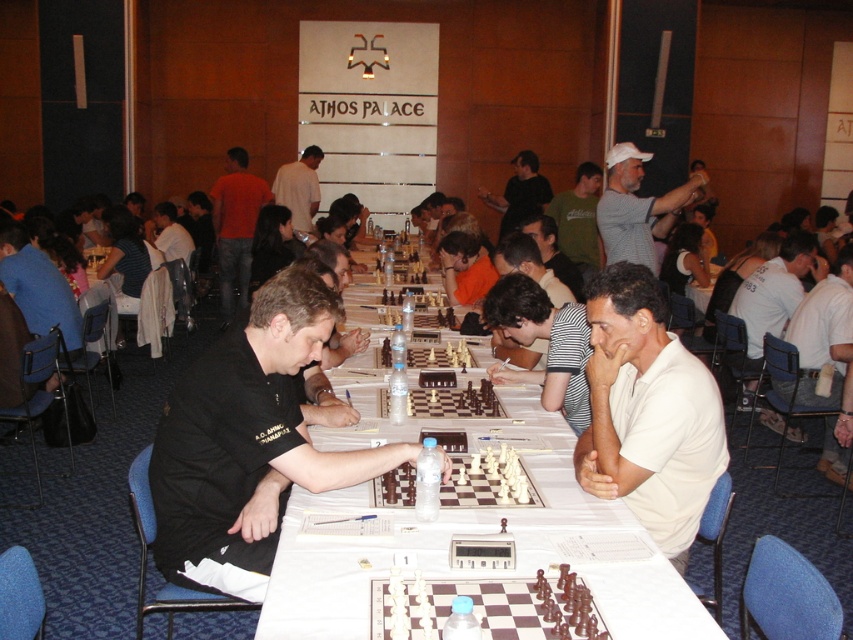
Is point (167, 490) positioned after point (598, 339)?

No, (167, 490) is closer to viewer.

Does black shirt at center appear over white matte shirt at center?

No, black shirt at center is not above white matte shirt at center.

Between point (241, 364) and point (643, 493), which one is positioned behind?

The point (643, 493) is behind.

Locate an element on the screen. Image resolution: width=853 pixels, height=640 pixels. black shirt at center is located at coordinates (247, 444).

Can you confirm if white cloth table at center is thinner than matte black shirt at center?

In fact, white cloth table at center might be wider than matte black shirt at center.

Does white cloth table at center come in front of matte black shirt at center?

Yes, white cloth table at center is closer to the viewer.

Is point (537, 404) positioned before point (540, 177)?

Yes, point (537, 404) is in front of point (540, 177).

Where is `white cloth table at center`? The image size is (853, 640). white cloth table at center is located at coordinates (590, 531).

From the picture: Is green cotton shirt at center in front of matte black shirt at center?

That is True.

Between point (579, 241) and point (517, 160), which one is positioned behind?

The point (517, 160) is behind.

Is point (553, 196) closer to camera compared to point (509, 161)?

Yes, point (553, 196) is in front of point (509, 161).

Locate an element on the screen. This screenshot has height=640, width=853. green cotton shirt at center is located at coordinates (579, 220).